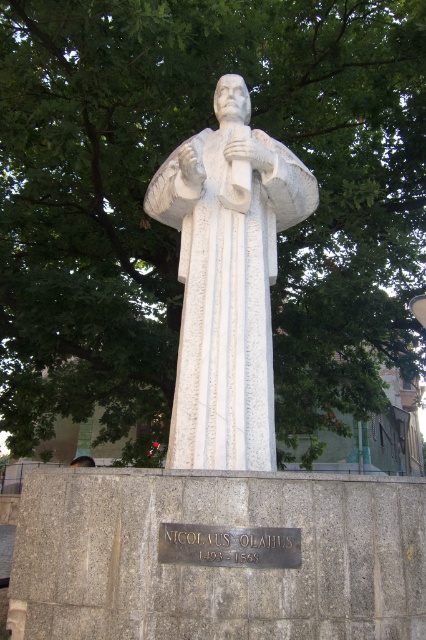
Which is more to the left, white marble statue at center or brown leather hat at lower left?

brown leather hat at lower left is more to the left.

Which is more to the right, white marble statue at center or brown leather hat at lower left?

Positioned to the right is white marble statue at center.

Describe the element at coordinates (227, 280) in the screenshot. I see `white marble statue at center` at that location.

In order to click on white marble statue at center in this screenshot , I will do pyautogui.click(x=227, y=280).

Between point (367, 33) and point (209, 284), which one is positioned behind?

The point (367, 33) is more distant.

Image resolution: width=426 pixels, height=640 pixels. Describe the element at coordinates (175, 230) in the screenshot. I see `green leafy tree at upper center` at that location.

Which is in front, point (155, 419) or point (313, 198)?

Positioned in front is point (313, 198).

At what (x,y) coordinates should I click in order to perform the action: click on green leafy tree at upper center. Please return your answer as a coordinate pair (x, y). The width and height of the screenshot is (426, 640). Looking at the image, I should click on click(x=175, y=230).

Which is more to the left, green leafy tree at upper center or brown leather hat at lower left?

Positioned to the left is brown leather hat at lower left.

Is green leafy tree at upper center thinner than brown leather hat at lower left?

Yes, green leafy tree at upper center is thinner than brown leather hat at lower left.

Is point (221, 12) farther from viewer compared to point (83, 465)?

No.

Where is `green leafy tree at upper center`? Image resolution: width=426 pixels, height=640 pixels. green leafy tree at upper center is located at coordinates (175, 230).